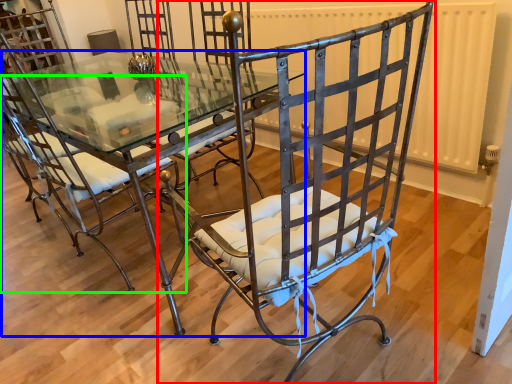
Question: Which object is the farthest from chair (highlighted by a red box)? Choose among these: table (highlighted by a blue box) or chair (highlighted by a green box).

Choices:
 (A) table
 (B) chair

Answer: (A)